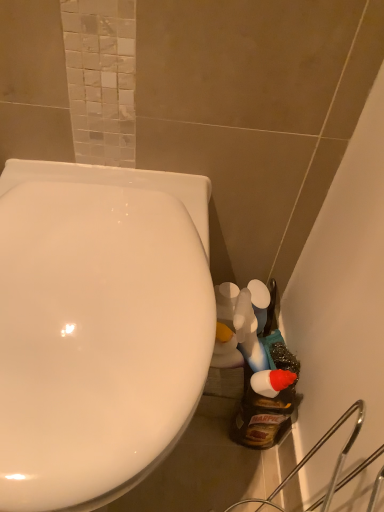
Locate an element on the screen. The height and width of the screenshot is (512, 384). white glossy toilet at left is located at coordinates (98, 327).

What do you see at coordinates (98, 327) in the screenshot? The width and height of the screenshot is (384, 512). I see `white glossy toilet at left` at bounding box center [98, 327].

In order to face white glossy toilet at left, should I rotate leftwards or rightwards?

Turn left by 13.792 degrees to look at white glossy toilet at left.

The image size is (384, 512). I want to click on white glossy toilet at left, so click(98, 327).